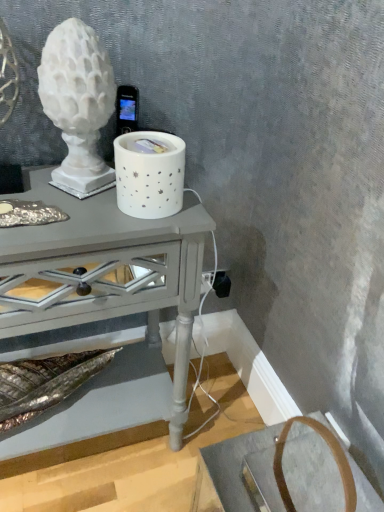
Where is `vacant space to the left of white ceramic candle holder at center, the 1th candle holder positioned from the right`? The image size is (384, 512). vacant space to the left of white ceramic candle holder at center, the 1th candle holder positioned from the right is located at coordinates (56, 206).